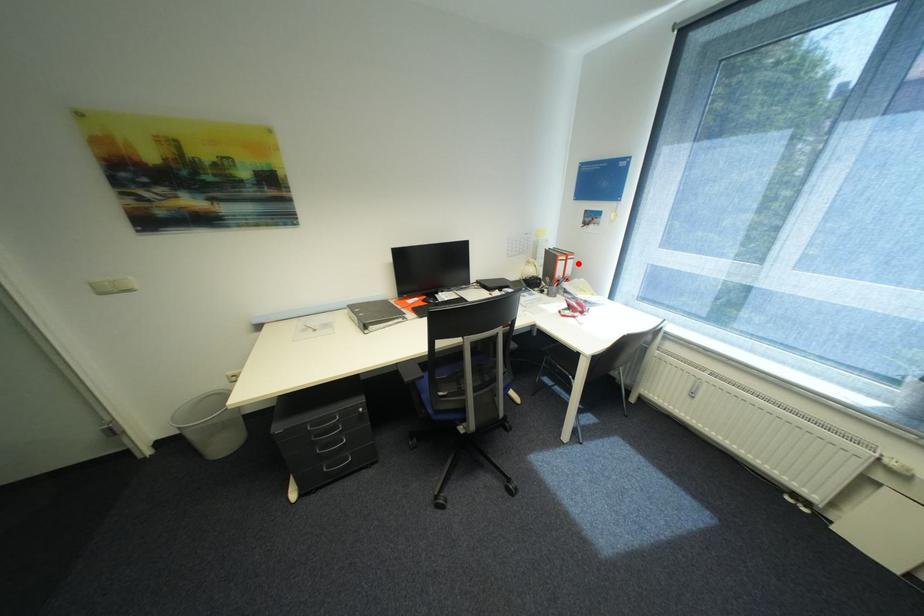
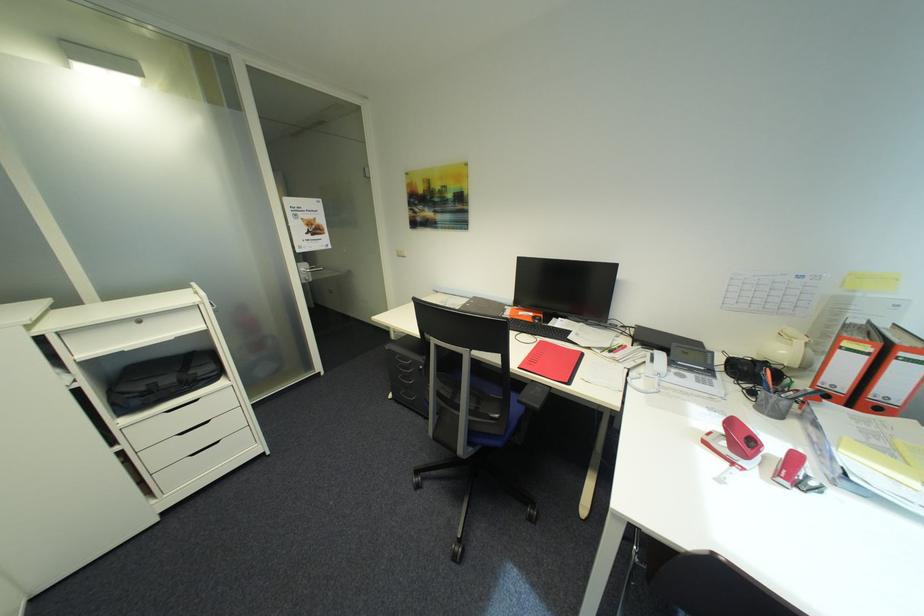
Question: I am providing you with two images of the same scene from different viewpoints. In image1, a red point is highlighted. Considering the same 3D point in image2, which of the following is correct?

Choices:
 (A) It is closer
 (B) It is farther

Answer: (B)